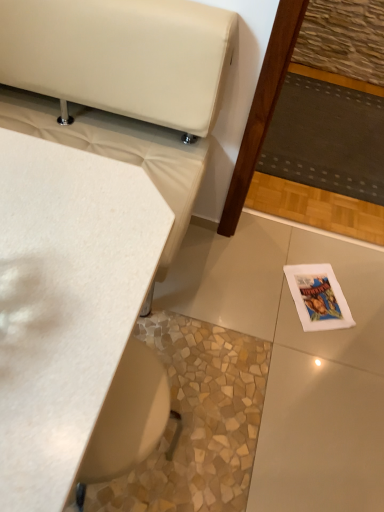
Question: Should I look upward or downward to see white paper magazine at lower right?

Choices:
 (A) down
 (B) up

Answer: (A)

Question: Can you confirm if white matte table at upper left is bigger than white paper magazine at lower right?

Choices:
 (A) no
 (B) yes

Answer: (B)

Question: Would you say white paper magazine at lower right is part of white matte table at upper left's contents?

Choices:
 (A) yes
 (B) no

Answer: (B)

Question: Is white matte table at upper left far from white paper magazine at lower right?

Choices:
 (A) yes
 (B) no

Answer: (A)

Question: Can you confirm if white matte table at upper left is positioned to the left of white paper magazine at lower right?

Choices:
 (A) no
 (B) yes

Answer: (B)

Question: From a real-world perspective, is white matte table at upper left physically below white paper magazine at lower right?

Choices:
 (A) yes
 (B) no

Answer: (B)

Question: Can you confirm if white matte table at upper left is wider than white paper magazine at lower right?

Choices:
 (A) no
 (B) yes

Answer: (B)

Question: Does white paper magazine at lower right appear on the left side of dark gray fabric mat at center right?

Choices:
 (A) no
 (B) yes

Answer: (B)

Question: Is white paper magazine at lower right shorter than dark gray fabric mat at center right?

Choices:
 (A) yes
 (B) no

Answer: (A)

Question: From the image's perspective, does white paper magazine at lower right appear lower than dark gray fabric mat at center right?

Choices:
 (A) no
 (B) yes

Answer: (B)

Question: Considering the relative sizes of white paper magazine at lower right and dark gray fabric mat at center right in the image provided, is white paper magazine at lower right wider than dark gray fabric mat at center right?

Choices:
 (A) no
 (B) yes

Answer: (A)

Question: Is white paper magazine at lower right surrounding dark gray fabric mat at center right?

Choices:
 (A) no
 (B) yes

Answer: (A)

Question: Would you say white paper magazine at lower right is outside dark gray fabric mat at center right?

Choices:
 (A) yes
 (B) no

Answer: (A)

Question: Can you confirm if white matte table at upper left is thinner than dark gray fabric mat at center right?

Choices:
 (A) no
 (B) yes

Answer: (B)